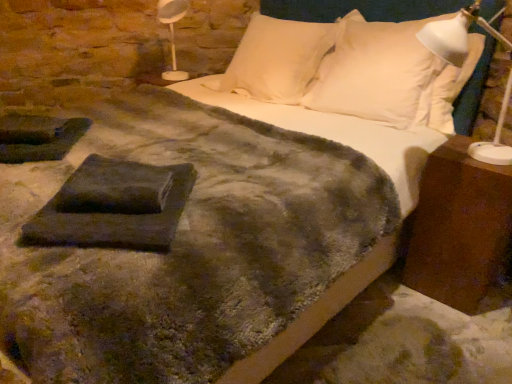
Locate an element on the screen. The image size is (512, 384). white plastic table lamp at upper left is located at coordinates (172, 33).

This screenshot has height=384, width=512. Describe the element at coordinates (460, 228) in the screenshot. I see `brown wood nightstand at right` at that location.

Identify the location of white soft pillow at upper right, which is the first pillow in right-to-left order. (381, 75).

Is white soft pillow at upper center, the 2th pillow viewed from the right, not close to brown wood nightstand at right?

white soft pillow at upper center, the 2th pillow viewed from the right, is far away from brown wood nightstand at right.

Does white soft pillow at upper center, the 2th pillow viewed from the right, have a smaller size compared to brown wood nightstand at right?

Incorrect, white soft pillow at upper center, the 2th pillow viewed from the right, is not smaller in size than brown wood nightstand at right.

From a real-world perspective, is white soft pillow at upper center, placed as the first pillow when sorted from left to right, under brown wood nightstand at right?

Incorrect, from a real-world perspective, white soft pillow at upper center, placed as the first pillow when sorted from left to right, is higher than brown wood nightstand at right.

Considering the sizes of objects dark gray felt at center and white soft pillow at upper right, which is the first pillow in right-to-left order, in the image provided, who is thinner, dark gray felt at center or white soft pillow at upper right, which is the first pillow in right-to-left order,?

With smaller width is white soft pillow at upper right, which is the first pillow in right-to-left order.

Is dark gray felt at center looking in the opposite direction of white soft pillow at upper right, which is the first pillow in right-to-left order?

No.

From the picture: How distant is dark gray felt at center from white soft pillow at upper right, which is the second pillow in left-to-right order?

A distance of 1.23 meters exists between dark gray felt at center and white soft pillow at upper right, which is the second pillow in left-to-right order.

Are dark gray felt at center and white soft pillow at upper right, which is the second pillow in left-to-right order, beside each other?

dark gray felt at center is not next to white soft pillow at upper right, which is the second pillow in left-to-right order, and they're not touching.

What's the angular difference between white plastic table lamp at upper left and brown wood nightstand at right's facing directions?

They differ by 45.1 degrees in their facing directions.

Relative to brown wood nightstand at right, is white plastic table lamp at upper left in front or behind?

Clearly, white plastic table lamp at upper left is behind brown wood nightstand at right.

Is white plastic table lamp at upper left positioned with its back to brown wood nightstand at right?

No, white plastic table lamp at upper left is not facing the opposite direction of brown wood nightstand at right.

Is white plastic table lamp at upper left taller or shorter than brown wood nightstand at right?

Clearly, white plastic table lamp at upper left is shorter compared to brown wood nightstand at right.

Which object is wider, white soft pillow at upper right, which is the first pillow in right-to-left order, or white plastic lamp at right?

white plastic lamp at right.

From their relative heights in the image, would you say white soft pillow at upper right, which is the first pillow in right-to-left order, is taller or shorter than white plastic lamp at right?

In the image, white soft pillow at upper right, which is the first pillow in right-to-left order, appears to be taller than white plastic lamp at right.

Is white soft pillow at upper right, which is the first pillow in right-to-left order, far from white plastic lamp at right?

No, white soft pillow at upper right, which is the first pillow in right-to-left order, is in close proximity to white plastic lamp at right.

Which is behind, white soft pillow at upper right, which is the second pillow in left-to-right order, or white plastic lamp at right?

white soft pillow at upper right, which is the second pillow in left-to-right order, is behind.

Is white soft pillow at upper center, placed as the first pillow when sorted from left to right, bigger or smaller than white plastic lamp at right?

white soft pillow at upper center, placed as the first pillow when sorted from left to right, is bigger than white plastic lamp at right.

Can you confirm if white soft pillow at upper center, placed as the first pillow when sorted from left to right, is positioned to the right of white plastic lamp at right?

In fact, white soft pillow at upper center, placed as the first pillow when sorted from left to right, is to the left of white plastic lamp at right.

Is white soft pillow at upper center, the 2th pillow viewed from the right, spatially inside white plastic lamp at right, or outside of it?

white soft pillow at upper center, the 2th pillow viewed from the right, exists outside the volume of white plastic lamp at right.

Which of these two, brown wood nightstand at right or white plastic table lamp at upper left, is smaller?

white plastic table lamp at upper left.

From a real-world perspective, is brown wood nightstand at right above or below white plastic table lamp at upper left?

brown wood nightstand at right is situated lower than white plastic table lamp at upper left in the real world.

Consider the image. Is brown wood nightstand at right turned away from white plastic table lamp at upper left?

brown wood nightstand at right is not turned away from white plastic table lamp at upper left.

Can you confirm if brown wood nightstand at right is wider than white plastic table lamp at upper left?

No.

Is white plastic lamp at right completely or partially outside of dark gray felt at center?

Yes, white plastic lamp at right is outside of dark gray felt at center.

You are a GUI agent. You are given a task and a screenshot of the screen. Output one action in this format:
    pyautogui.click(x=<x>, y=<y>)
    Task: Click on the bedside lamp located behind the dark gray felt at center
    This screenshot has width=512, height=384.
    Given the screenshot: What is the action you would take?
    pyautogui.click(x=457, y=34)

Considering the sizes of white plastic lamp at right and dark gray felt at center in the image, is white plastic lamp at right taller or shorter than dark gray felt at center?

white plastic lamp at right is taller than dark gray felt at center.

Is white plastic lamp at right thinner than dark gray felt at center?

No, white plastic lamp at right is not thinner than dark gray felt at center.

Which pillow is the 2nd one when counting from the left side of the brown wood nightstand at right? Please provide its 2D coordinates.

[(276, 59)]

From the dark gray felt at center, count 2nd pillow to the right and point to it. Please provide its 2D coordinates.

[(381, 75)]

Estimate the real-world distances between objects in this image. Which object is further from white plastic table lamp at upper left, brown wood nightstand at right or white plastic lamp at right?

brown wood nightstand at right.

From the image, which object appears to be nearer to white soft pillow at upper center, the 2th pillow viewed from the right, white plastic table lamp at upper left or white plastic lamp at right?

The object closer to white soft pillow at upper center, the 2th pillow viewed from the right, is white plastic table lamp at upper left.

Looking at the image, which one is located further to white plastic lamp at right, dark gray felt at center or white plastic table lamp at upper left?

The object further to white plastic lamp at right is white plastic table lamp at upper left.

Looking at the image, which one is located closer to white plastic lamp at right, brown wood nightstand at right or white plastic table lamp at upper left?

Based on the image, brown wood nightstand at right appears to be nearer to white plastic lamp at right.

Looking at this image, which object lies nearer to the anchor point white soft pillow at upper right, which is the first pillow in right-to-left order, dark gray felt at center or white plastic table lamp at upper left?

dark gray felt at center is closer to white soft pillow at upper right, which is the first pillow in right-to-left order.

Which object lies nearer to the anchor point dark gray felt at center, white soft pillow at upper center, placed as the first pillow when sorted from left to right, or white plastic lamp at right?

Based on the image, white soft pillow at upper center, placed as the first pillow when sorted from left to right, appears to be nearer to dark gray felt at center.

Based on the photo, which object lies further to the anchor point white soft pillow at upper right, which is the first pillow in right-to-left order, white soft pillow at upper center, the 2th pillow viewed from the right, or white plastic table lamp at upper left?

white plastic table lamp at upper left is positioned further to the anchor white soft pillow at upper right, which is the first pillow in right-to-left order.

Looking at the image, which one is located closer to white soft pillow at upper right, which is the first pillow in right-to-left order, brown wood nightstand at right or white soft pillow at upper center, the 2th pillow viewed from the right?

white soft pillow at upper center, the 2th pillow viewed from the right, is closer to white soft pillow at upper right, which is the first pillow in right-to-left order.

Locate an element on the screen. Image resolution: width=512 pixels, height=384 pixels. slate between white plastic table lamp at upper left and white soft pillow at upper right, which is the first pillow in right-to-left order, in the horizontal direction is located at coordinates (114, 207).

Where is `bedside lamp between dark gray felt at center and white soft pillow at upper center, placed as the first pillow when sorted from left to right, along the z-axis`? This screenshot has height=384, width=512. bedside lamp between dark gray felt at center and white soft pillow at upper center, placed as the first pillow when sorted from left to right, along the z-axis is located at coordinates (457, 34).

The height and width of the screenshot is (384, 512). I want to click on pillow between white soft pillow at upper center, placed as the first pillow when sorted from left to right, and brown wood nightstand at right from top to bottom, so click(381, 75).

At what (x,y) coordinates should I click in order to perform the action: click on slate located between white plastic table lamp at upper left and white plastic lamp at right in the left-right direction. Please return your answer as a coordinate pair (x, y). Looking at the image, I should click on (114, 207).